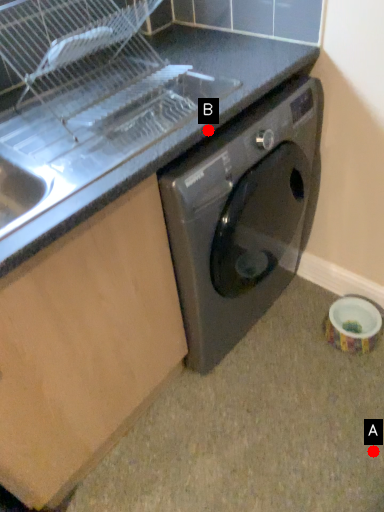
Question: Two points are circled on the image, labeled by A and B beside each circle. Which point is closer to the camera taking this photo?

Choices:
 (A) A is closer
 (B) B is closer

Answer: (B)